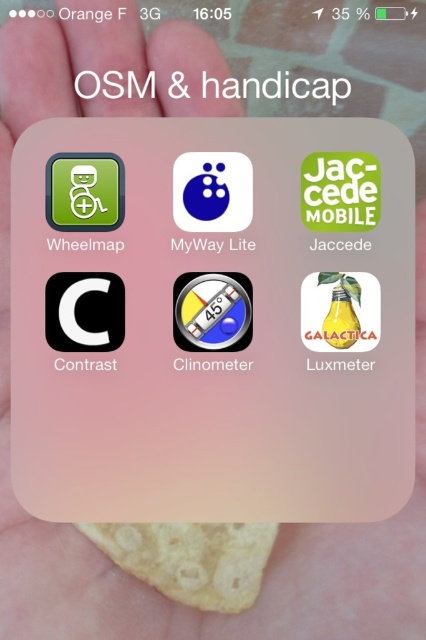
Is yellow crispy chip at center to the right of blue glossy sphere at center from the viewer's perspective?

No, yellow crispy chip at center is not to the right of blue glossy sphere at center.

How much distance is there between yellow crispy chip at center and blue glossy sphere at center?

12.50 inches

Is point (132, 548) closer to viewer compared to point (224, 186)?

Yes, it is in front of point (224, 186).

Find the location of a particular element. This screenshot has width=426, height=640. yellow crispy chip at center is located at coordinates (190, 557).

Between yellow crispy chip at center and translucent glass clinometer at center, which one has more height?

Standing taller between the two is yellow crispy chip at center.

How distant is yellow crispy chip at center from translucent glass clinometer at center?

7.87 inches

Is point (204, 573) in front of point (201, 339)?

Yes, point (204, 573) is in front of point (201, 339).

Where is `yellow crispy chip at center`? yellow crispy chip at center is located at coordinates (190, 557).

Who is more forward, (176, 596) or (106, 224)?

Positioned in front is point (176, 596).

Who is lower down, yellow crispy chip at center or green matte icon at upper left?

yellow crispy chip at center is lower down.

Is point (175, 582) behind point (115, 211)?

No, it is not.

Where is `yellow crispy chip at center`? This screenshot has width=426, height=640. yellow crispy chip at center is located at coordinates (190, 557).